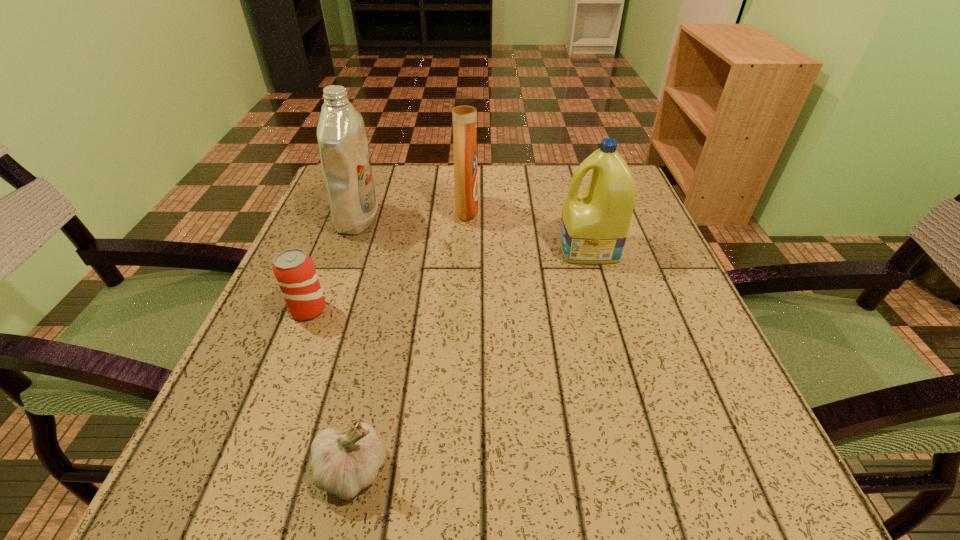
Locate an element on the screen. This screenshot has height=540, width=960. free space at the far edge is located at coordinates pos(483,168).

In order to click on vacant space at the near edge of the desktop in this screenshot , I will do `click(469, 455)`.

Image resolution: width=960 pixels, height=540 pixels. In the image, there is a desktop. In order to click on blank space at the left edge in this screenshot , I will do `click(271, 299)`.

Find the location of a particular element. vacant space at the right edge of the desktop is located at coordinates (671, 278).

In the image, there is a desktop. In order to click on vacant region at the far left corner in this screenshot , I will do `click(391, 197)`.

In the image, there is a desktop. Identify the location of free region at the near left corner. This screenshot has height=540, width=960. pos(293,484).

Where is `vacant area that lies between the second detergent from right to left and the rightmost object`? vacant area that lies between the second detergent from right to left and the rightmost object is located at coordinates (528, 229).

Find the location of a particular element. Image resolution: width=960 pixels, height=540 pixels. empty space between the beer can and the garlic is located at coordinates (330, 390).

The width and height of the screenshot is (960, 540). What are the coordinates of `free spot between the rightmost object and the fourth object from left to right` in the screenshot? It's located at (528, 229).

At what (x,y) coordinates should I click in order to perform the action: click on free point between the second detergent from left to right and the leftmost detergent. Please return your answer as a coordinate pair (x, y). Image resolution: width=960 pixels, height=540 pixels. Looking at the image, I should click on (412, 214).